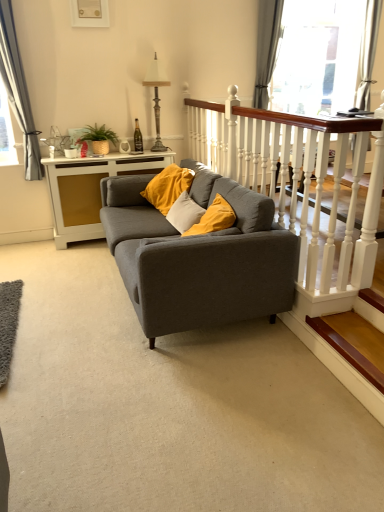
In order to click on vacant space situated on the left part of matte gray couch at center in this screenshot , I will do `click(71, 292)`.